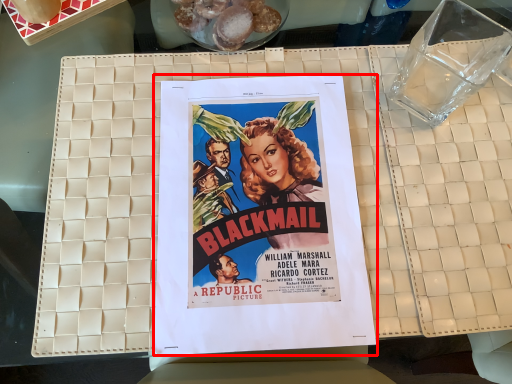
Question: From the image, what is the correct spatial relationship of poster (annotated by the red box) in relation to food?

Choices:
 (A) right
 (B) left

Answer: (A)